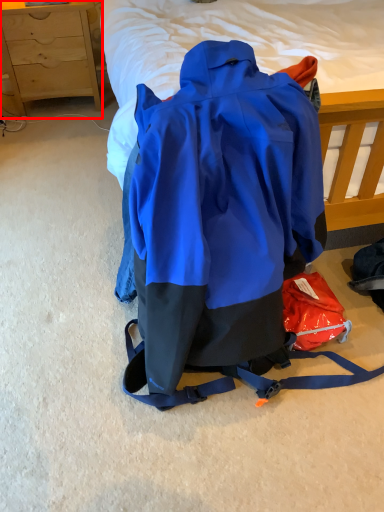
Question: From the image's perspective, where is chest of drawers (annotated by the red box) located relative to backpack?

Choices:
 (A) below
 (B) above

Answer: (B)